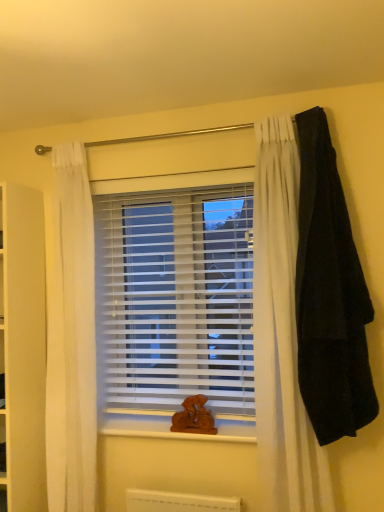
Where is `black woolen blanket at right`? black woolen blanket at right is located at coordinates (329, 295).

You are a GUI agent. You are given a task and a screenshot of the screen. Output one action in this format:
    pyautogui.click(x=<x>, y=<y>)
    Task: Click on the white plastic blinds at center
    The image size is (384, 512).
    Given the screenshot: What is the action you would take?
    pyautogui.click(x=177, y=296)

You are a GUI agent. You are given a task and a screenshot of the screen. Output one action in this format:
    pyautogui.click(x=<x>, y=<y>)
    Task: Click on the black woolen blanket at right
    This screenshot has width=384, height=512.
    Given the screenshot: What is the action you would take?
    pyautogui.click(x=329, y=295)

Based on the photo, is white plastic blinds at center next to black woolen blanket at right?

No, white plastic blinds at center is not touching black woolen blanket at right.

I want to click on blanket above the white plastic blinds at center (from a real-world perspective), so click(x=329, y=295).

Can you confirm if white plastic blinds at center is wider than black woolen blanket at right?

No, white plastic blinds at center is not wider than black woolen blanket at right.

From the image's perspective, is wooden at center located beneath white plastic blinds at center?

Yes, from the image's perspective, wooden at center is below white plastic blinds at center.

Considering the relative sizes of wooden at center and white plastic blinds at center in the image provided, is wooden at center thinner than white plastic blinds at center?

No, wooden at center is not thinner than white plastic blinds at center.

Considering the relative positions of wooden at center and white plastic blinds at center in the image provided, is wooden at center behind white plastic blinds at center?

No, wooden at center is closer to the viewer.

Is wooden at center smaller than white plastic blinds at center?

Yes, wooden at center is smaller than white plastic blinds at center.

From a real-world perspective, is wooden at center physically located above or below black woolen blanket at right?

From a real-world perspective, wooden at center is physically below black woolen blanket at right.

In the scene shown: Relative to black woolen blanket at right, is wooden at center in front or behind?

wooden at center is positioned farther from the viewer than black woolen blanket at right.

Considering the positions of points (102, 433) and (325, 292), is point (102, 433) closer to camera compared to point (325, 292)?

That is False.

Between black woolen blanket at right and white plastic blinds at center, which one has more height?

black woolen blanket at right is taller.

Based on the photo, from a real-world perspective, is black woolen blanket at right physically above white plastic blinds at center?

Yes, from a real-world perspective, black woolen blanket at right is on top of white plastic blinds at center.

Are white plastic blinds at center and wooden at center far apart?

That's not correct — white plastic blinds at center is a little close to wooden at center.

Considering the relative sizes of white plastic blinds at center and wooden at center in the image provided, is white plastic blinds at center wider than wooden at center?

No, white plastic blinds at center is not wider than wooden at center.

From a real-world perspective, which object rests below the other?

From a 3D spatial view, wooden at center is below.

How distant is white plastic blinds at center from wooden at center?

They are 18.83 inches apart.

Is black woolen blanket at right to the left of wooden at center from the viewer's perspective?

Incorrect, black woolen blanket at right is not on the left side of wooden at center.

Is black woolen blanket at right in front of or behind wooden at center in the image?

black woolen blanket at right is positioned closer to the viewer than wooden at center.

Is black woolen blanket at right inside or outside of wooden at center?

black woolen blanket at right is located beyond the bounds of wooden at center.

From a real-world perspective, does black woolen blanket at right sit lower than wooden at center?

No, from a real-world perspective, black woolen blanket at right is not under wooden at center.

Locate an element on the screen. blanket located in front of the white plastic blinds at center is located at coordinates (329, 295).

This screenshot has height=512, width=384. What are the coordinates of `window sill located below the white plastic blinds at center (from the image's perspective)` in the screenshot? It's located at (170, 426).

When comparing their distances from black woolen blanket at right, does wooden at center or white plastic blinds at center seem closer?

white plastic blinds at center is positioned closer to the anchor black woolen blanket at right.

When comparing their distances from wooden at center, does black woolen blanket at right or white plastic blinds at center seem closer?

white plastic blinds at center is positioned closer to the anchor wooden at center.

Considering their positions, is wooden at center positioned further to white plastic blinds at center than black woolen blanket at right?

Based on the image, black woolen blanket at right appears to be further to white plastic blinds at center.

Considering their positions, is white plastic blinds at center positioned closer to wooden at center than black woolen blanket at right?

white plastic blinds at center lies closer to wooden at center than the other object.

From the image, which object appears to be nearer to black woolen blanket at right, white plastic blinds at center or wooden at center?

white plastic blinds at center is positioned closer to the anchor black woolen blanket at right.

Considering their positions, is black woolen blanket at right positioned closer to white plastic blinds at center than wooden at center?

The object closer to white plastic blinds at center is wooden at center.

Where is `window blind between black woolen blanket at right and wooden at center in the up-down direction`? window blind between black woolen blanket at right and wooden at center in the up-down direction is located at coordinates click(177, 296).